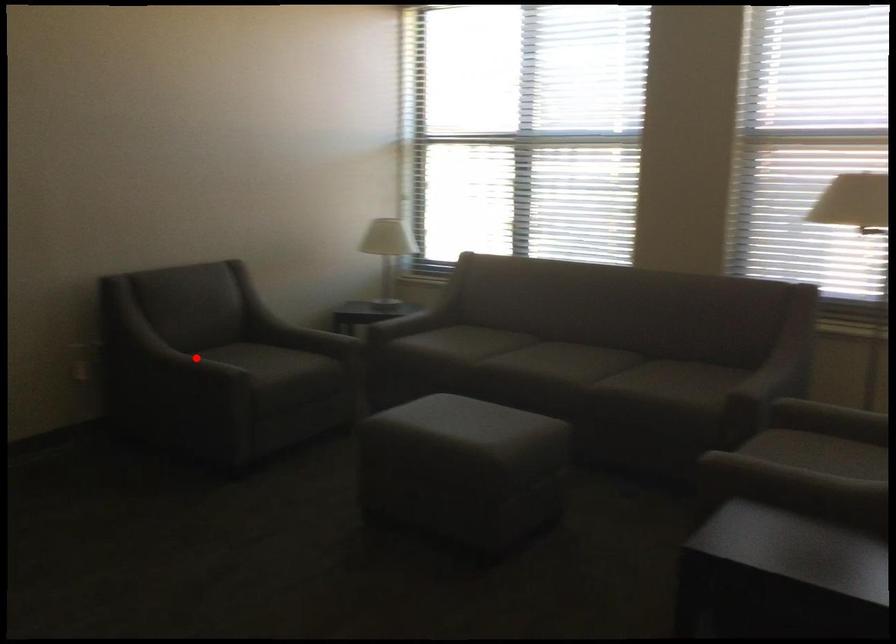
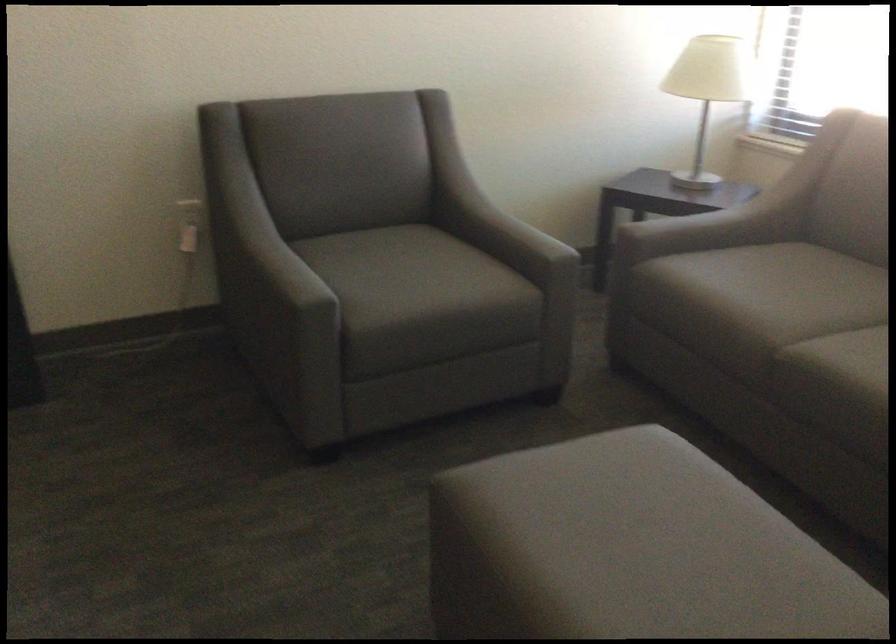
The point at the highlighted location is marked in the first image. Where is the corresponding point in the second image?

(281, 265)